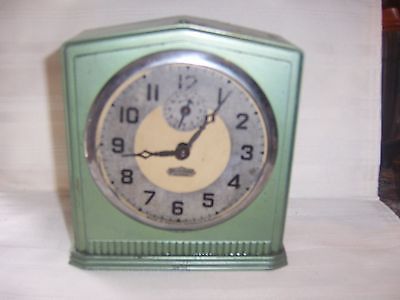
What are the coordinates of `right side of clock` in the screenshot? It's located at (292, 149).